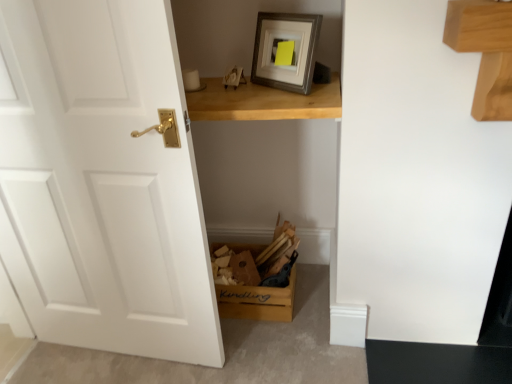
Question: Does wooden kindling box at lower center have a greater width compared to white matte door at left?

Choices:
 (A) no
 (B) yes

Answer: (B)

Question: Does wooden kindling box at lower center have a lesser height compared to white matte door at left?

Choices:
 (A) yes
 (B) no

Answer: (A)

Question: Is wooden kindling box at lower center located outside white matte door at left?

Choices:
 (A) no
 (B) yes

Answer: (B)

Question: Is wooden kindling box at lower center thinner than white matte door at left?

Choices:
 (A) no
 (B) yes

Answer: (A)

Question: Considering the relative positions of wooden kindling box at lower center and white matte door at left in the image provided, is wooden kindling box at lower center to the left of white matte door at left from the viewer's perspective?

Choices:
 (A) yes
 (B) no

Answer: (B)

Question: Considering the positions of white matte door at left and wooden kindling box at lower center in the image, is white matte door at left wider or thinner than wooden kindling box at lower center?

Choices:
 (A) thin
 (B) wide

Answer: (A)

Question: In terms of size, does white matte door at left appear bigger or smaller than wooden kindling box at lower center?

Choices:
 (A) small
 (B) big

Answer: (B)

Question: Is point (18, 163) positioned closer to the camera than point (227, 296)?

Choices:
 (A) farther
 (B) closer

Answer: (B)

Question: From the image's perspective, relative to wooden kindling box at lower center, is white matte door at left above or below?

Choices:
 (A) above
 (B) below

Answer: (A)

Question: From a real-world perspective, is light brown wooden table at upper center positioned above or below white matte door at left?

Choices:
 (A) above
 (B) below

Answer: (A)

Question: Is point (208, 117) closer or farther from the camera than point (95, 190)?

Choices:
 (A) closer
 (B) farther

Answer: (B)

Question: In terms of width, does light brown wooden table at upper center look wider or thinner when compared to white matte door at left?

Choices:
 (A) wide
 (B) thin

Answer: (A)

Question: From their relative heights in the image, would you say light brown wooden table at upper center is taller or shorter than white matte door at left?

Choices:
 (A) short
 (B) tall

Answer: (A)

Question: Is point (182, 235) positioned closer to the camera than point (221, 97)?

Choices:
 (A) farther
 (B) closer

Answer: (B)

Question: From the image's perspective, relative to light brown wooden table at upper center, is white matte door at left above or below?

Choices:
 (A) below
 (B) above

Answer: (A)